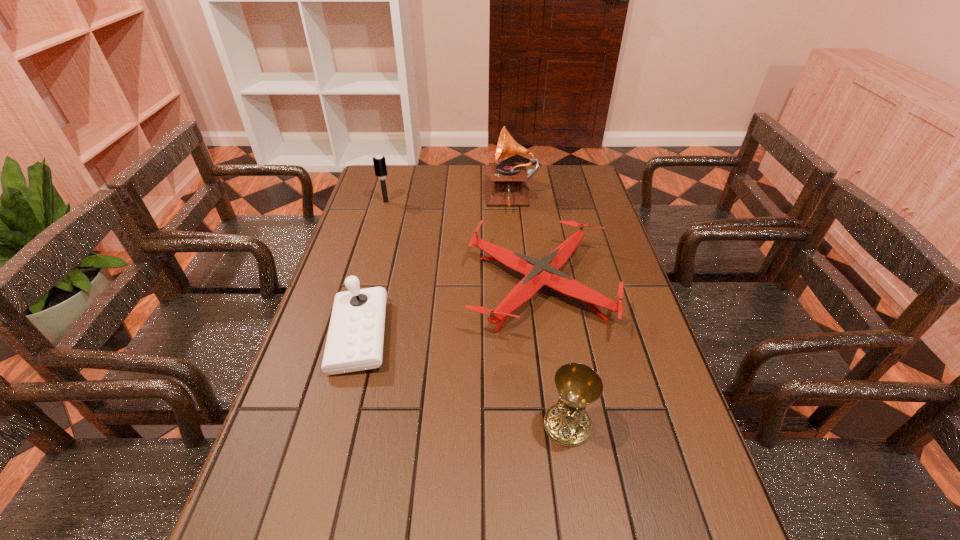
Where is `unoccupied position between the hairbrush and the chalice`? This screenshot has width=960, height=540. unoccupied position between the hairbrush and the chalice is located at coordinates (476, 313).

What are the coordinates of `free space between the chalice and the drone` in the screenshot? It's located at point(553,356).

Where is `vacant space that's between the fifth tallest object and the joystick`? vacant space that's between the fifth tallest object and the joystick is located at coordinates (449, 312).

In order to click on free spot between the joystick and the fifth farthest object in this screenshot , I will do `click(463, 380)`.

Locate an element on the screen. This screenshot has width=960, height=540. free spot between the drone and the hairbrush is located at coordinates (463, 245).

Identify the location of vacant area that lies between the hairbrush and the second shortest object. The image size is (960, 540). (463, 245).

At what (x,y) coordinates should I click in order to perform the action: click on vacant area between the drone and the phonograph record. Please return your answer as a coordinate pair (x, y). Looking at the image, I should click on (525, 244).

Locate an element on the screen. free point between the joystick and the hairbrush is located at coordinates (x=372, y=269).

The height and width of the screenshot is (540, 960). Find the location of `blank region between the second shortest object and the hairbrush`. blank region between the second shortest object and the hairbrush is located at coordinates (463, 245).

Locate which object is the second closest to the phonograph record. Please provide its 2D coordinates. Your answer should be formatted as a tuple, i.e. [(x, y)], where the tuple contains the x and y coordinates of a point satisfying the conditions above.

[(379, 162)]